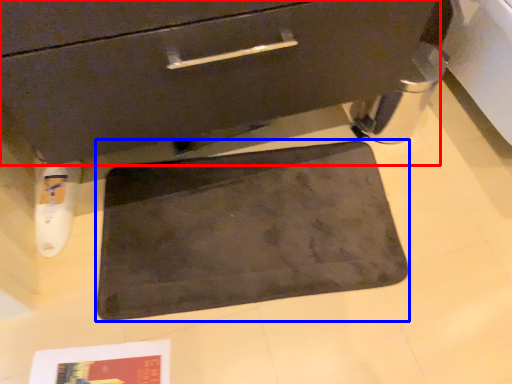
Question: Which point is closer to the camera, drawer (highlighted by a red box) or bath mat (highlighted by a blue box)?

Choices:
 (A) drawer
 (B) bath mat

Answer: (A)